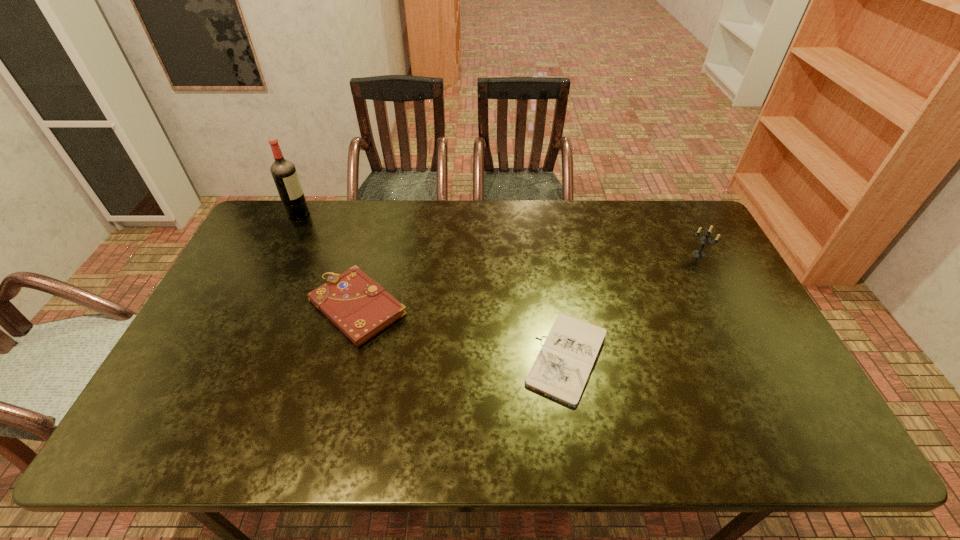
Where is `vacant space positioned on the left of the left notebook`? vacant space positioned on the left of the left notebook is located at coordinates (273, 307).

Where is `vacant area situated 0.110m on the front of the second object from right to left`? The height and width of the screenshot is (540, 960). vacant area situated 0.110m on the front of the second object from right to left is located at coordinates (584, 453).

Identify the location of object located at the far edge. Image resolution: width=960 pixels, height=540 pixels. (284, 173).

The height and width of the screenshot is (540, 960). In order to click on object that is at the left edge in this screenshot , I will do `click(284, 173)`.

Where is `object present at the right edge`? object present at the right edge is located at coordinates (704, 240).

You are a GUI agent. You are given a task and a screenshot of the screen. Output one action in this format:
    pyautogui.click(x=<x>, y=<y>)
    Task: Click on the object that is at the far left corner
    The width and height of the screenshot is (960, 540).
    Given the screenshot: What is the action you would take?
    pyautogui.click(x=284, y=173)

Where is `free space at the far edge of the desktop`? The width and height of the screenshot is (960, 540). free space at the far edge of the desktop is located at coordinates (628, 213).

Where is `blank space at the near edge of the desktop`? The height and width of the screenshot is (540, 960). blank space at the near edge of the desktop is located at coordinates (653, 451).

Identify the location of free space at the right edge of the desktop. The width and height of the screenshot is (960, 540). (737, 326).

The image size is (960, 540). In the image, there is a desktop. In order to click on vacant space at the far right corner in this screenshot , I will do `click(679, 215)`.